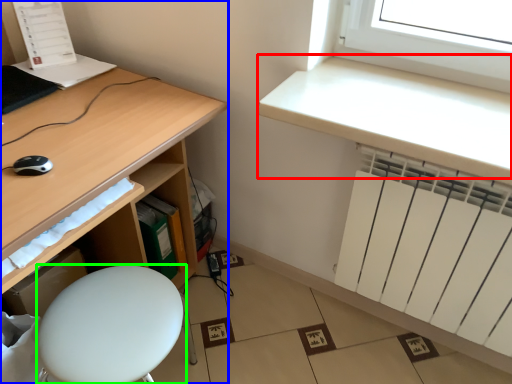
Question: Based on their relative distances, which object is nearer to counter top (highlighted by a red box)? Choose from desk (highlighted by a blue box) and furniture (highlighted by a green box).

Choices:
 (A) desk
 (B) furniture

Answer: (A)